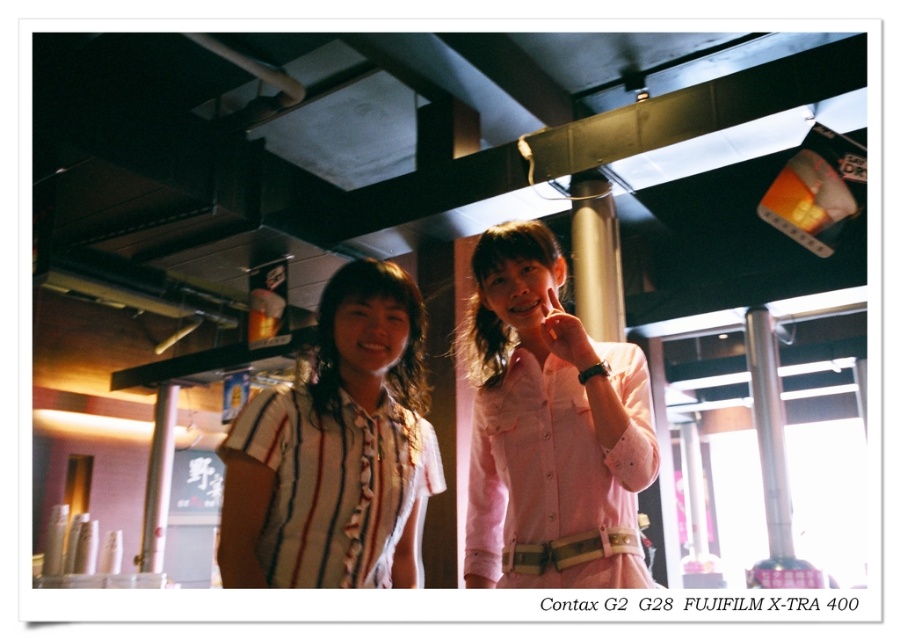
Question: Does pink satin shirt at center have a smaller size compared to white striped fabric shirt at left?

Choices:
 (A) yes
 (B) no

Answer: (B)

Question: Which point is farther to the camera?

Choices:
 (A) white striped fabric shirt at left
 (B) striped cotton shirt at center
 (C) pink satin shirt at center

Answer: (C)

Question: Where is striped cotton shirt at center located in relation to white striped fabric shirt at left in the image?

Choices:
 (A) right
 (B) left

Answer: (A)

Question: Estimate the real-world distances between objects in this image. Which object is farther from the white striped fabric shirt at left?

Choices:
 (A) pink satin shirt at center
 (B) striped cotton shirt at center

Answer: (A)

Question: Which object is closer to the camera taking this photo?

Choices:
 (A) pink satin shirt at center
 (B) striped cotton shirt at center

Answer: (B)

Question: Can you confirm if pink satin shirt at center is positioned above white striped fabric shirt at left?

Choices:
 (A) yes
 (B) no

Answer: (A)